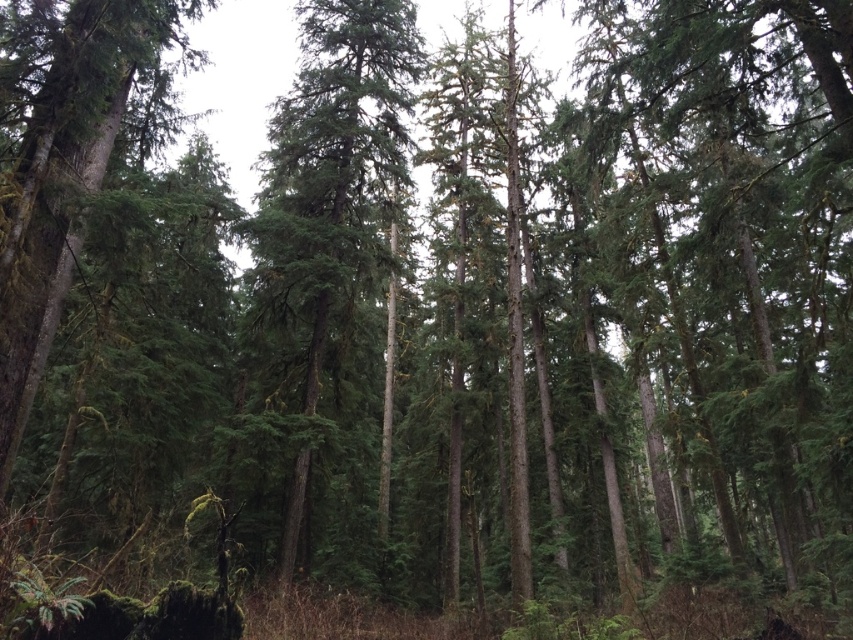
In the dense forest scene with tall coniferous trees, you spot a specific point marked at coordinates (331, 195). What type of foliage is located exactly at that point?

The point (331, 195) has green needle like foliage.